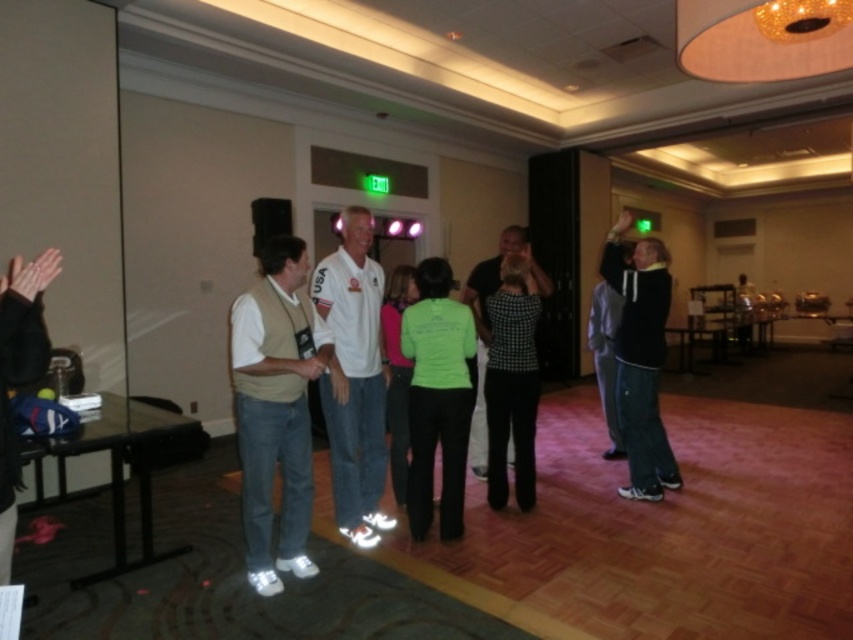
You are standing at the entrance of the conference room and see a white matte shirt at center. Can you tell me what is located exactly at the coordinates point (x=354, y=378)?

The point (x=354, y=378) is where the white matte shirt at center is located.

You are organizing a clothing donation drive and need to pack items into boxes. You have a box that can only hold items with a thickness of up to 2 inches. You have the light brown suede vest at center and the dark gray hoodie at right. Which item can fit into the box based on their thickness?

The light brown suede vest at center is thinner than the dark gray hoodie at right, so the light brown suede vest at center can fit into the box since it meets the thickness requirement of 2 inches or less.